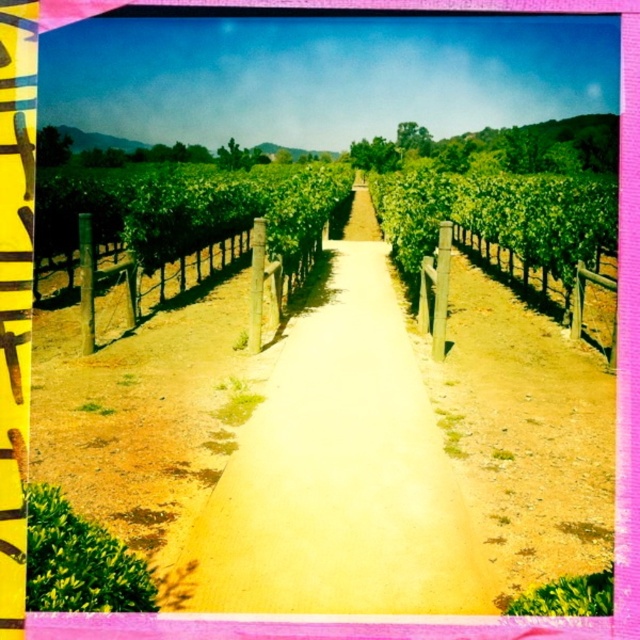
You are a gardener standing at the entrance of the vineyard and see the dirt path at center and the wooden post at center. Which object is positioned lower from the ground?

The dirt path at center is positioned lower from the ground than the wooden post at center.

You are standing at the starting point of the dirt path in the vineyard. You see a wooden post fence at left marked by point (x=186, y=276). If you walk straight along the path, will you eventually pass by the wooden post fence at left?

The wooden post fence at left marked by point (x=186, y=276) is located to the left of the dirt path. Since you are walking straight along the path, you will not pass by the wooden post fence at left as it remains to your left side.